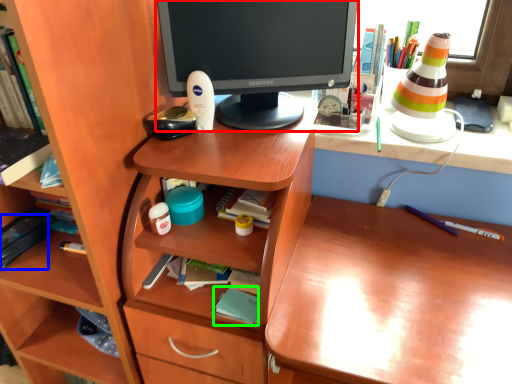
Question: Which object is the closest to the computer monitor (highlighted by a red box)? Choose among these: book (highlighted by a blue box) or book (highlighted by a green box).

Choices:
 (A) book
 (B) book

Answer: (B)